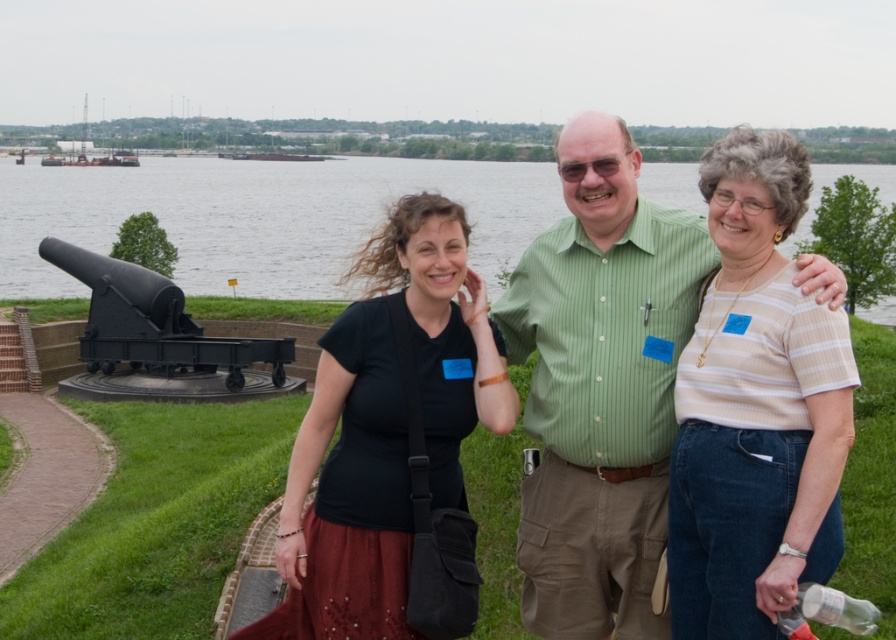
What do you see at coordinates (347, 493) in the screenshot?
I see `black matte shirt at center` at bounding box center [347, 493].

Which is more to the right, black matte shirt at center or black matte cannon at lower left?

From the viewer's perspective, black matte shirt at center appears more on the right side.

Between point (352, 580) and point (132, 288), which one is positioned behind?

The point (132, 288) is more distant.

Find the location of `black matte shirt at center`. black matte shirt at center is located at coordinates (347, 493).

Does black matte shirt at center appear over green striped shirt at center?

Actually, black matte shirt at center is below green striped shirt at center.

Is black matte shirt at center below green striped shirt at center?

Correct, black matte shirt at center is located below green striped shirt at center.

Where is `black matte shirt at center`? This screenshot has width=896, height=640. black matte shirt at center is located at coordinates (347, 493).

Does glossy water at center have a larger size compared to green striped shirt at center?

Yes, glossy water at center is bigger than green striped shirt at center.

Does glossy water at center appear on the right side of green striped shirt at center?

In fact, glossy water at center is to the left of green striped shirt at center.

The height and width of the screenshot is (640, 896). What are the coordinates of `glossy water at center` in the screenshot? It's located at (260, 216).